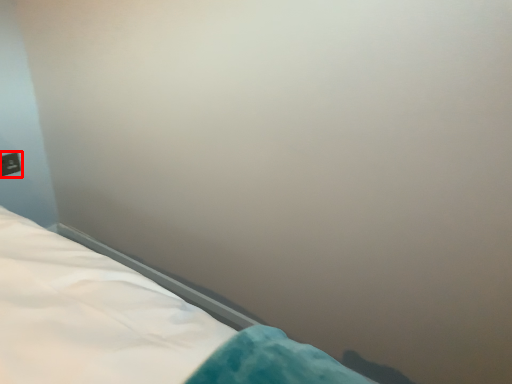
Question: From the image's perspective, considering the relative positions of electric outlet (annotated by the red box) and bed in the image provided, where is electric outlet (annotated by the red box) located with respect to the staircase?

Choices:
 (A) above
 (B) below

Answer: (A)